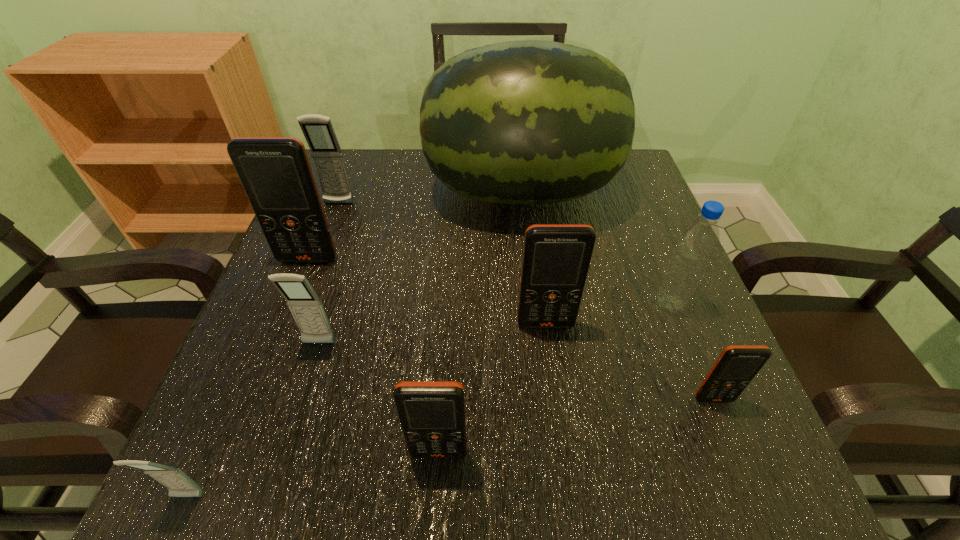
Identify the location of cellular telephone identified as the second closest to the smallest gray cellular telephone. (432, 413).

Choose which orange cellular telephone is the nearest neighbor to the green watermelon. Please provide its 2D coordinates. Your answer should be formatted as a tuple, i.e. [(x, y)], where the tuple contains the x and y coordinates of a point satisfying the conditions above.

[(275, 172)]

Where is `the second closest orange cellular telephone relative to the green watermelon`? the second closest orange cellular telephone relative to the green watermelon is located at coordinates (556, 257).

Locate an element on the screen. The width and height of the screenshot is (960, 540). gray cellular telephone that can be found as the second closest to the nearest cellular telephone is located at coordinates (318, 131).

The image size is (960, 540). What are the coordinates of `gray cellular telephone that is the closest to the smallest gray cellular telephone` in the screenshot? It's located at (306, 307).

Find the location of a particular element. The image size is (960, 540). free space in the image that satisfies the following two spatial constraints: 1. on the front-facing side of the sixth nearest object; 2. on the right side of the farthest cellular telephone is located at coordinates (302, 303).